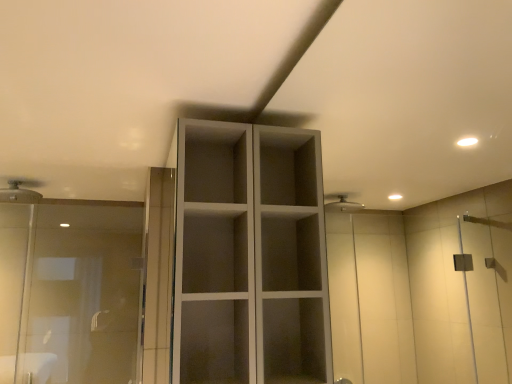
This screenshot has height=384, width=512. Describe the element at coordinates (249, 256) in the screenshot. I see `white matte cupboard at center` at that location.

What is the approximate width of white matte cupboard at center?

The width of white matte cupboard at center is 10.97 inches.

You are a GUI agent. You are given a task and a screenshot of the screen. Output one action in this format:
    pyautogui.click(x=<x>, y=<y>)
    Task: Click on the matte white shower head at upper left
    The image size is (512, 384).
    Given the screenshot: What is the action you would take?
    pyautogui.click(x=21, y=191)

Image resolution: width=512 pixels, height=384 pixels. I want to click on white matte cupboard at center, so click(x=249, y=256).

Can you confirm if white matte cupboard at center is taller than transparent glass shower door at left?

Correct, white matte cupboard at center is much taller as transparent glass shower door at left.

Would you consider white matte cupboard at center to be distant from transparent glass shower door at left?

Yes.

Which is behind, white matte cupboard at center or transparent glass shower door at left?

transparent glass shower door at left is further from the camera.

From a real-world perspective, between white matte cupboard at center and transparent glass shower door at left, who is vertically lower?

In real-world perspective, transparent glass shower door at left is lower.

Is matte white shower head at upper left next to transparent glass shower door at left and touching it?

No, matte white shower head at upper left is not making contact with transparent glass shower door at left.

Is matte white shower head at upper left spatially inside transparent glass shower door at left, or outside of it?

matte white shower head at upper left is outside transparent glass shower door at left.

Does matte white shower head at upper left appear on the right side of transparent glass shower door at left?

No.

Which object is more forward, matte white shower head at upper left or transparent glass shower door at left?

transparent glass shower door at left is in front.

From a real-world perspective, is matte white shower head at upper left below white matte cupboard at center?

Actually, matte white shower head at upper left is physically above white matte cupboard at center in the real world.

Considering the relative sizes of matte white shower head at upper left and white matte cupboard at center in the image provided, is matte white shower head at upper left taller than white matte cupboard at center?

In fact, matte white shower head at upper left may be shorter than white matte cupboard at center.

From the image's perspective, is matte white shower head at upper left beneath white matte cupboard at center?

No.

How many degrees apart are the facing directions of matte white shower head at upper left and white matte cupboard at center?

They differ by 90 degrees in their facing directions.

From a real-world perspective, is transparent glass shower door at left below white matte cupboard at center?

Correct, in the physical world, transparent glass shower door at left is lower than white matte cupboard at center.

From the image's perspective, which is below, transparent glass shower door at left or white matte cupboard at center?

transparent glass shower door at left is shown below in the image.

In the image, there is a white matte cupboard at center. At what (x,y) coordinates should I click in order to perform the action: click on screen door below it (from a real-world perspective). Please return your answer as a coordinate pair (x, y). The height and width of the screenshot is (384, 512). Looking at the image, I should click on (69, 292).

Is transparent glass shower door at left oriented towards white matte cupboard at center?

No.

Is white matte cupboard at center located outside matte white shower head at upper left?

Yes, white matte cupboard at center is not within matte white shower head at upper left.

Between white matte cupboard at center and matte white shower head at upper left, which one is positioned behind?

matte white shower head at upper left is further away from the camera.

Is white matte cupboard at center smaller than matte white shower head at upper left?

Incorrect, white matte cupboard at center is not smaller in size than matte white shower head at upper left.

Is white matte cupboard at center facing away from matte white shower head at upper left?

white matte cupboard at center is not turned away from matte white shower head at upper left.

From a real-world perspective, is transparent glass shower door at left under matte white shower head at upper left?

Correct, in the physical world, transparent glass shower door at left is lower than matte white shower head at upper left.

Is transparent glass shower door at left far away from matte white shower head at upper left?

That's not correct — transparent glass shower door at left is a little close to matte white shower head at upper left.

Is transparent glass shower door at left smaller than matte white shower head at upper left?

No.

Where is `screen door below the white matte cupboard at center (from a real-world perspective)`? The image size is (512, 384). screen door below the white matte cupboard at center (from a real-world perspective) is located at coordinates (69, 292).

Where is `screen door lying below the matte white shower head at upper left (from the image's perspective)`? This screenshot has width=512, height=384. screen door lying below the matte white shower head at upper left (from the image's perspective) is located at coordinates (69, 292).

When comparing their distances from white matte cupboard at center, does matte white shower head at upper left or transparent glass shower door at left seem further?

The object further to white matte cupboard at center is matte white shower head at upper left.

From the image, which object appears to be nearer to white matte cupboard at center, transparent glass shower door at left or matte white shower head at upper left?

transparent glass shower door at left is closer to white matte cupboard at center.

Based on their spatial positions, is transparent glass shower door at left or white matte cupboard at center further from matte white shower head at upper left?

The object further to matte white shower head at upper left is white matte cupboard at center.

When comparing their distances from transparent glass shower door at left, does white matte cupboard at center or matte white shower head at upper left seem further?

Among the two, white matte cupboard at center is located further to transparent glass shower door at left.

Considering their positions, is white matte cupboard at center positioned further to matte white shower head at upper left than transparent glass shower door at left?

The object further to matte white shower head at upper left is white matte cupboard at center.

When comparing their distances from transparent glass shower door at left, does matte white shower head at upper left or white matte cupboard at center seem further?

white matte cupboard at center is further to transparent glass shower door at left.

You are a GUI agent. You are given a task and a screenshot of the screen. Output one action in this format:
    pyautogui.click(x=<x>, y=<y>)
    Task: Click on the screen door positioned between white matte cupboard at center and matte white shower head at upper left from near to far
    
    Given the screenshot: What is the action you would take?
    (69, 292)